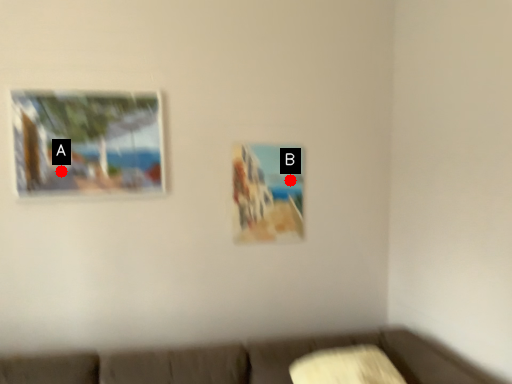
Question: Two points are circled on the image, labeled by A and B beside each circle. Which point is further to the camera?

Choices:
 (A) A is further
 (B) B is further

Answer: (B)